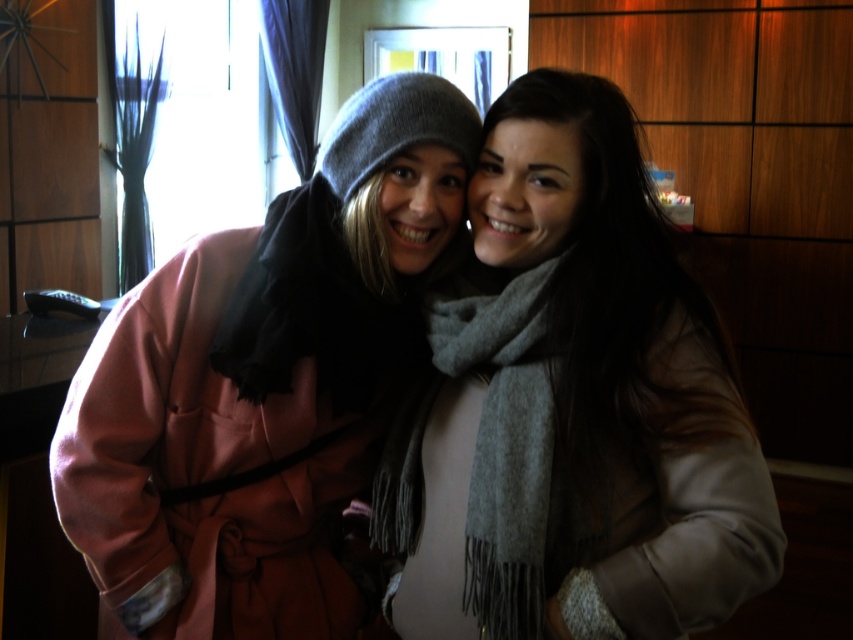
Who is shorter, matte pink coat at left or gray woolen scarf at center?

gray woolen scarf at center is shorter.

Is matte pink coat at left below gray woolen scarf at center?

No.

Where is `matte pink coat at left`? matte pink coat at left is located at coordinates (263, 385).

Consider the image. Does gray wool scarf at center have a lesser width compared to gray woolen scarf at center?

Incorrect, gray wool scarf at center's width is not less than gray woolen scarf at center's.

Is gray wool scarf at center smaller than gray woolen scarf at center?

Incorrect, gray wool scarf at center is not smaller in size than gray woolen scarf at center.

Does point (607, 220) lie behind point (550, 435)?

Yes, point (607, 220) is behind point (550, 435).

I want to click on gray wool scarf at center, so click(x=572, y=406).

Is point (585, 122) closer to camera compared to point (212, 580)?

Yes, it is in front of point (212, 580).

What are the coordinates of `gray wool scarf at center` in the screenshot? It's located at (572, 406).